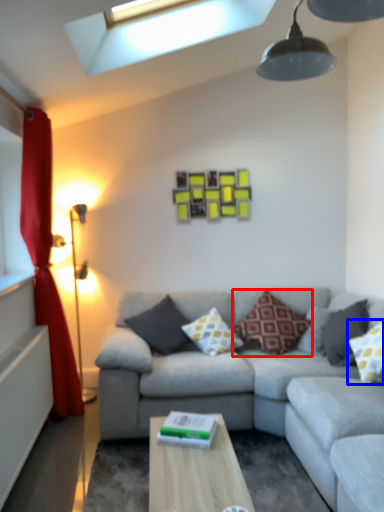
Question: Which object appears closest to the camera in this image, pillow (highlighted by a red box) or pillow (highlighted by a blue box)?

Choices:
 (A) pillow
 (B) pillow

Answer: (B)